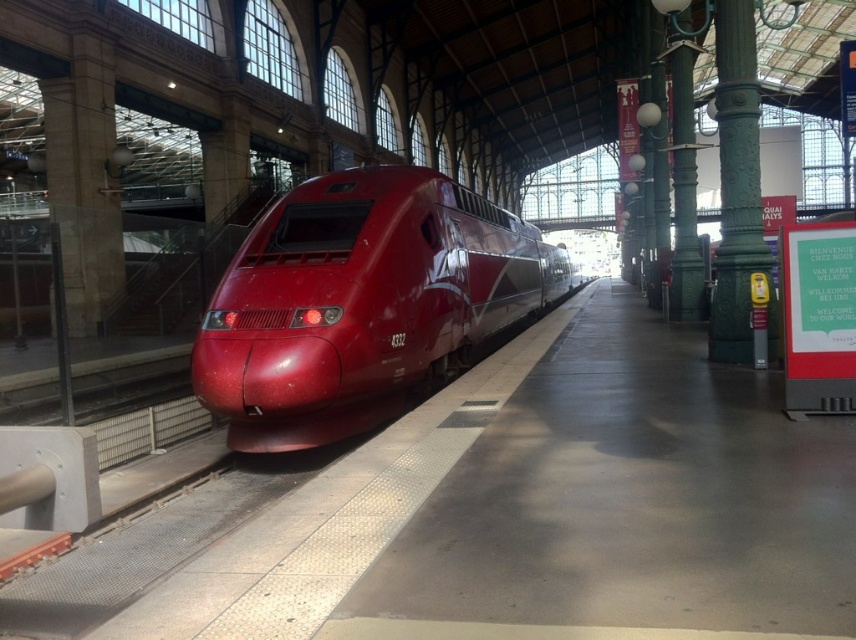
You are standing on the platform of the train station. You see the point marked at coordinates (361, 301). What object is located at that point?

The point at coordinates (361, 301) marks the glossy red bullet train at center.

You are standing on the platform at the train station and want to take a photo of the point marked at coordinate (396, 365). If your camera has a focal length of 50mm and you are 8.29 meters away from the point, what is the angle of view required to capture the point in the center of your photo?

The point marked at coordinate (396, 365) is 8.29 meters away from the camera. To calculate the angle of view needed, use the formula for angle of view which is 2 times the arctangent of the sensor width divided by twice the focal length. However, without knowing the sensor size, we can state that the distance is sufficient for most standard cameras to capture the point within the frame, especially if centered. The exact angle would depend on the sensor dimensions.

Consider the image. You are standing on the platform and want to take a photo of the glossy red bullet train at center without any obstructions. Is the green polished metal pillar at right blocking your view?

The glossy red bullet train at center is closer to the viewer than the green polished metal pillar at right, so the pillar is behind the train and won